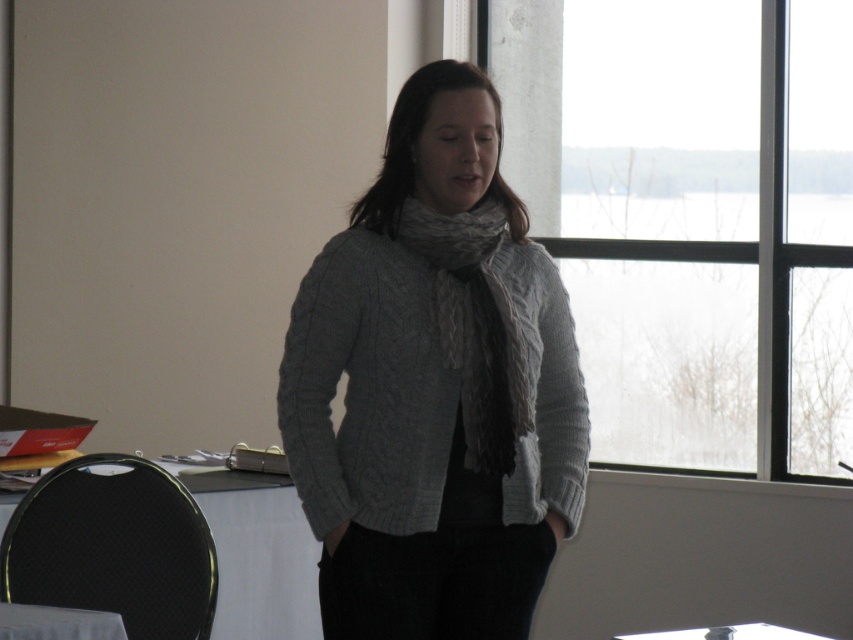
Can you confirm if white fabric table at lower left is smaller than white glossy table at lower left?

Actually, white fabric table at lower left might be larger than white glossy table at lower left.

Looking at this image, how far apart are white fabric table at lower left and white glossy table at lower left?

white fabric table at lower left and white glossy table at lower left are 4.54 feet apart from each other.

Measure the distance between white fabric table at lower left and camera.

white fabric table at lower left is 4.10 meters from camera.

You are a GUI agent. You are given a task and a screenshot of the screen. Output one action in this format:
    pyautogui.click(x=<x>, y=<y>)
    Task: Click on the white fabric table at lower left
    The height and width of the screenshot is (640, 853).
    Given the screenshot: What is the action you would take?
    pyautogui.click(x=259, y=556)

Consider the image. Does transparent glass window at upper right appear over gray knitted scarf at center?

Correct, transparent glass window at upper right is located above gray knitted scarf at center.

Describe the element at coordinates (693, 218) in the screenshot. The image size is (853, 640). I see `transparent glass window at upper right` at that location.

Is point (659, 412) more distant than point (519, 358)?

Yes, point (659, 412) is farther from viewer.

Identify the location of transparent glass window at upper right. The width and height of the screenshot is (853, 640). (693, 218).

Between point (418, 460) and point (241, 490), which one is positioned behind?

The point (241, 490) is behind.

Between knitted gray sweater at center and white fabric table at lower left, which one has more height?

knitted gray sweater at center

Who is more forward, (x=408, y=216) or (x=245, y=477)?

Point (x=408, y=216) is more forward.

Find the location of `knitted gray sweater at center`. knitted gray sweater at center is located at coordinates (434, 387).